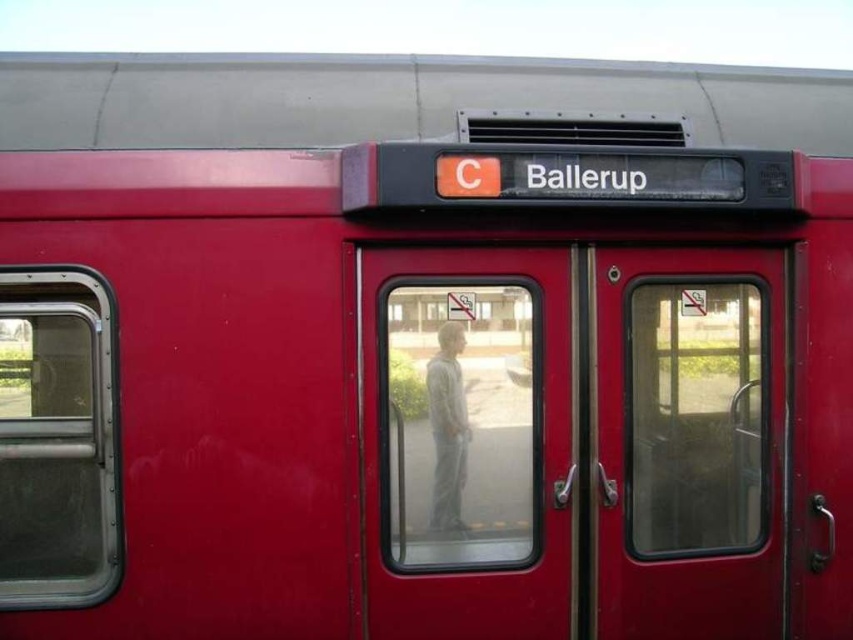
Question: Is the position of matte glass door at center more distant than that of gray fabric pants at center?

Choices:
 (A) yes
 (B) no

Answer: (A)

Question: Which is farther from the gray fabric pants at center?

Choices:
 (A) transparent glass door at center
 (B) matte glass door at center

Answer: (B)

Question: Does transparent glass door at center have a larger size compared to gray fabric pants at center?

Choices:
 (A) no
 (B) yes

Answer: (B)

Question: Considering the real-world distances, which object is farthest from the transparent glass door at center?

Choices:
 (A) gray fabric pants at center
 (B) matte glass door at center

Answer: (B)

Question: Based on their relative distances, which object is farther from the matte glass door at center?

Choices:
 (A) gray fabric pants at center
 (B) transparent glass door at center

Answer: (A)

Question: Is matte glass door at center positioned behind gray fabric pants at center?

Choices:
 (A) yes
 (B) no

Answer: (A)